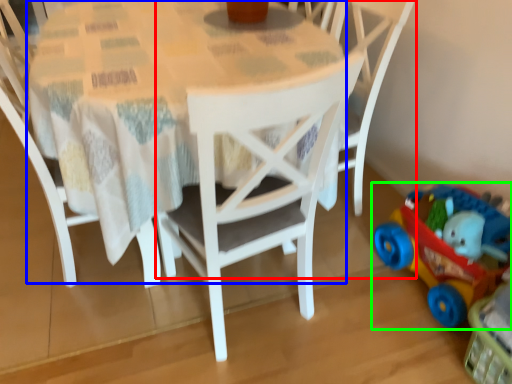
Question: Which object is positioned closest to chair (highlighted by a red box)? Select from round table (highlighted by a blue box) and toy (highlighted by a green box).

Choices:
 (A) round table
 (B) toy

Answer: (B)